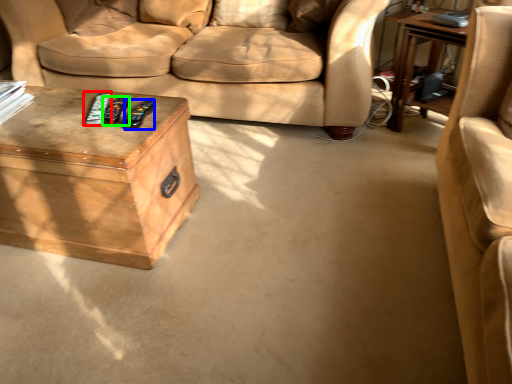
Question: Which object is positioned farthest from remote (highlighted by a red box)? Select from remote (highlighted by a blue box) and remote (highlighted by a green box).

Choices:
 (A) remote
 (B) remote

Answer: (A)